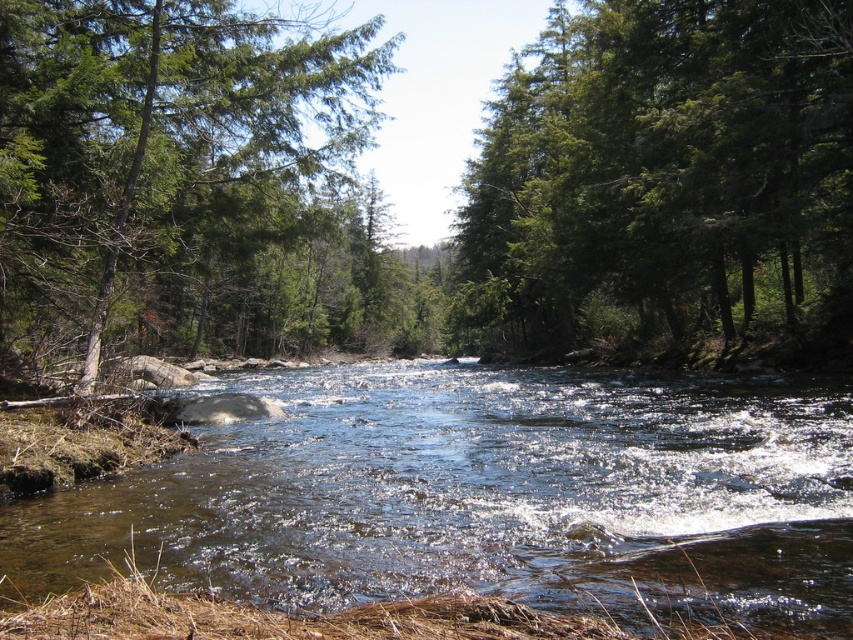
You are a photographer standing at the edge of the river and want to capture a photo that includes both the clear water at center and the green matte tree at upper right. Which object will appear taller in the photo?

The green matte tree at upper right will appear taller in the photo because it is taller than the clear water at center.